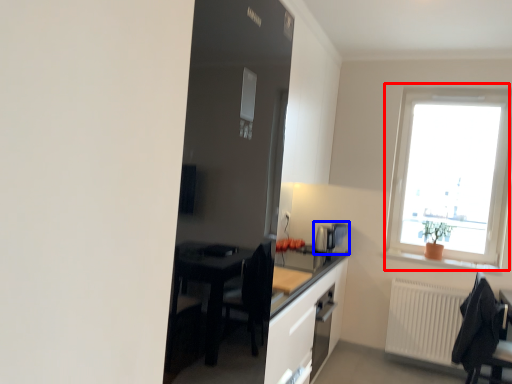
Question: Among these objects, which one is farthest to the camera, window (highlighted by a red box) or coffee machine (highlighted by a blue box)?

Choices:
 (A) window
 (B) coffee machine

Answer: (B)